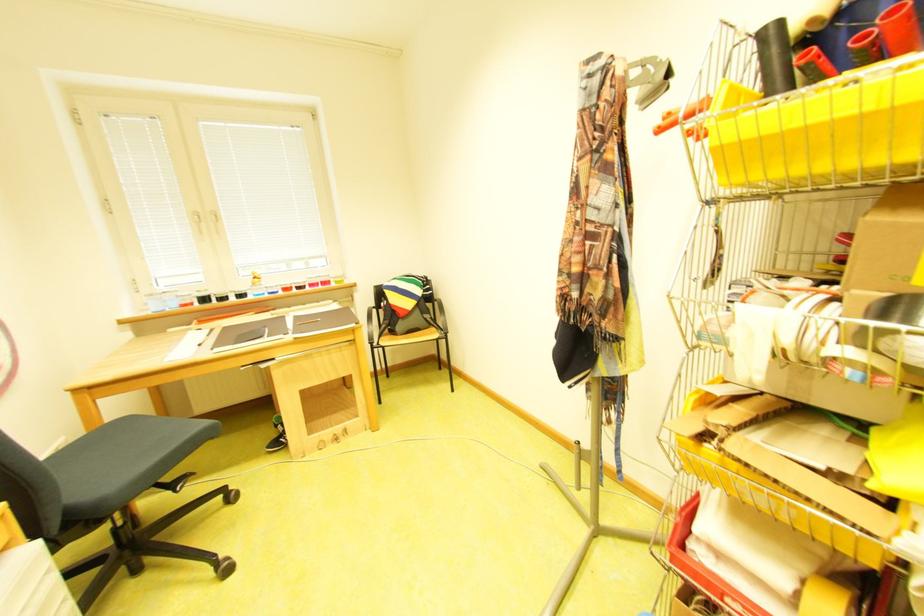
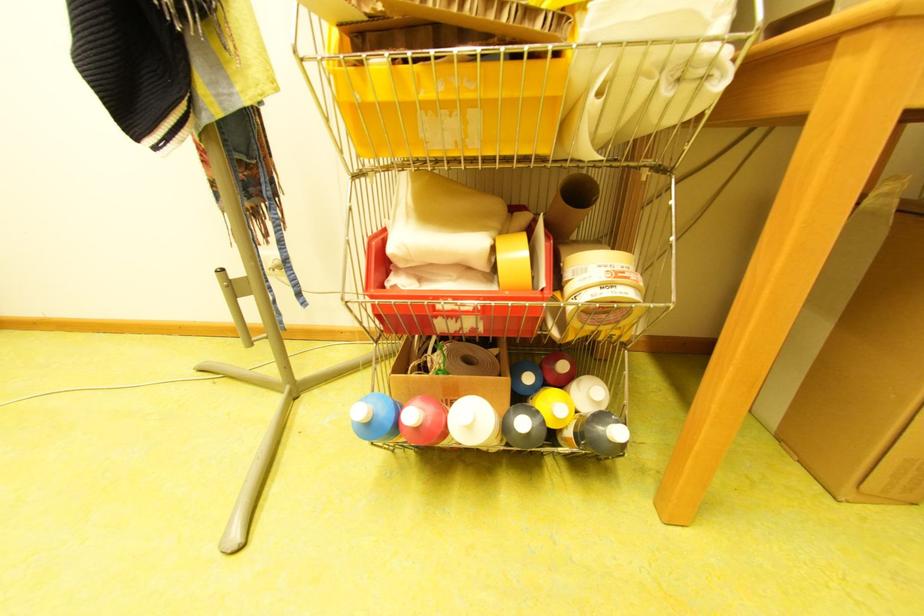
Question: How did the camera likely rotate?

Choices:
 (A) Left
 (B) Right
 (C) Up
 (D) Down

Answer: (B)